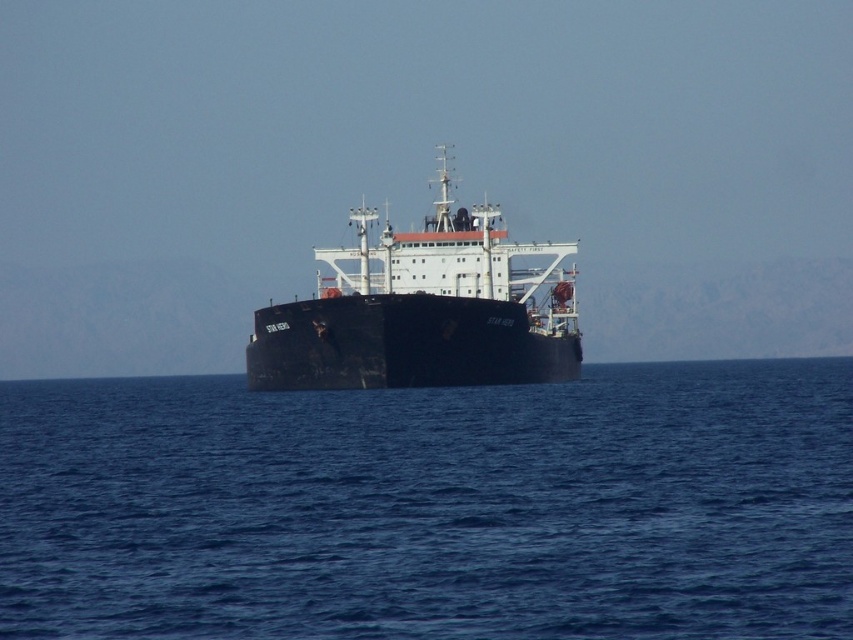
Question: Which point appears closest to the camera in this image?

Choices:
 (A) pyautogui.click(x=469, y=310)
 (B) pyautogui.click(x=300, y=579)

Answer: (B)

Question: Which object is farther from the camera taking this photo?

Choices:
 (A) black matte ship at center
 (B) blue water at center

Answer: (A)

Question: Can you confirm if blue water at center is bigger than black matte ship at center?

Choices:
 (A) yes
 (B) no

Answer: (B)

Question: Is blue water at center positioned before black matte ship at center?

Choices:
 (A) no
 (B) yes

Answer: (B)

Question: Is blue water at center positioned before black matte ship at center?

Choices:
 (A) yes
 (B) no

Answer: (A)